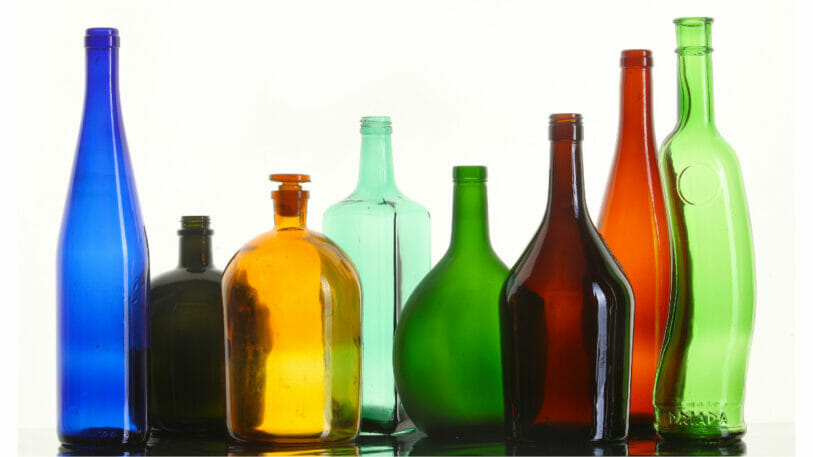
Where is `bottles`? bottles is located at coordinates (100, 283), (188, 308), (300, 302), (383, 233), (468, 274), (546, 277), (631, 216), (716, 228).